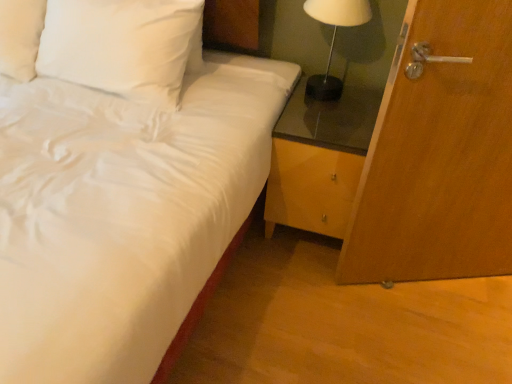
Question: Is wooden door at right at the left side of white glossy table lamp at upper right?

Choices:
 (A) no
 (B) yes

Answer: (A)

Question: Is wooden door at right located outside white glossy table lamp at upper right?

Choices:
 (A) yes
 (B) no

Answer: (A)

Question: Can you confirm if wooden door at right is taller than white glossy table lamp at upper right?

Choices:
 (A) yes
 (B) no

Answer: (A)

Question: From the image's perspective, is wooden door at right on white glossy table lamp at upper right?

Choices:
 (A) yes
 (B) no

Answer: (B)

Question: Is white glossy table lamp at upper right at the back of wooden door at right?

Choices:
 (A) yes
 (B) no

Answer: (A)

Question: Is wooden door at right oriented towards white glossy table lamp at upper right?

Choices:
 (A) no
 (B) yes

Answer: (A)

Question: Is white satin pillow at upper left closer to camera compared to wooden door at right?

Choices:
 (A) yes
 (B) no

Answer: (B)

Question: From the image's perspective, is white satin pillow at upper left below wooden door at right?

Choices:
 (A) no
 (B) yes

Answer: (A)

Question: Considering the relative sizes of white satin pillow at upper left and wooden door at right in the image provided, is white satin pillow at upper left smaller than wooden door at right?

Choices:
 (A) yes
 (B) no

Answer: (B)

Question: Is white satin pillow at upper left oriented towards wooden door at right?

Choices:
 (A) no
 (B) yes

Answer: (A)

Question: Is white satin pillow at upper left shorter than wooden door at right?

Choices:
 (A) yes
 (B) no

Answer: (A)

Question: Does white satin pillow at upper left appear on the left side of wooden door at right?

Choices:
 (A) no
 (B) yes

Answer: (B)

Question: Is white satin pillow at upper left thinner than white satin bed at center?

Choices:
 (A) no
 (B) yes

Answer: (B)